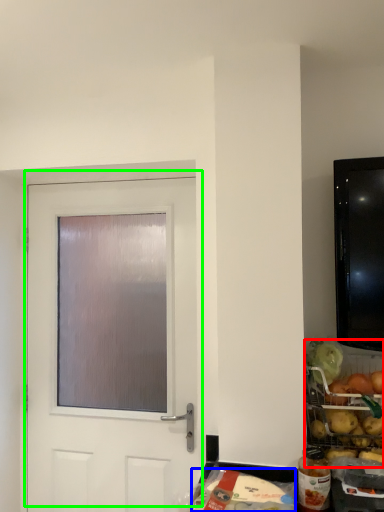
Question: Considering the real-world distances, which object is closest to food (highlighted by a red box)? food (highlighted by a blue box) or door (highlighted by a green box).

Choices:
 (A) food
 (B) door

Answer: (A)